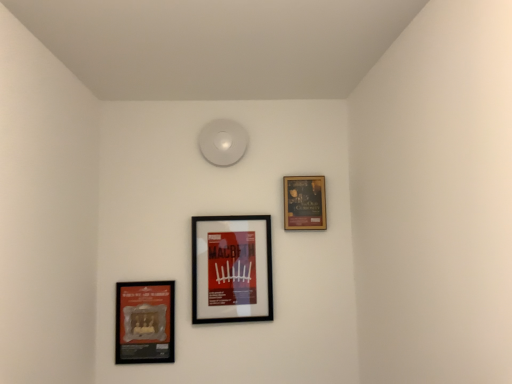
Question: Is the depth of wooden frame at upper right, acting as the first picture frame starting from the right, less than that of matte black picture frame at lower left, positioned as the 3th picture frame in right-to-left order?

Choices:
 (A) yes
 (B) no

Answer: (B)

Question: Does wooden frame at upper right, marked as the third picture frame in a left-to-right arrangement, have a lesser height compared to matte black picture frame at lower left, positioned as the 3th picture frame in right-to-left order?

Choices:
 (A) yes
 (B) no

Answer: (A)

Question: Is wooden frame at upper right, acting as the first picture frame starting from the right, not close to matte black picture frame at lower left, the first picture frame when ordered from left to right?

Choices:
 (A) yes
 (B) no

Answer: (B)

Question: From a real-world perspective, is wooden frame at upper right, acting as the first picture frame starting from the right, below matte black picture frame at lower left, positioned as the 3th picture frame in right-to-left order?

Choices:
 (A) yes
 (B) no

Answer: (B)

Question: Is wooden frame at upper right, acting as the first picture frame starting from the right, next to matte black picture frame at lower left, the first picture frame when ordered from left to right?

Choices:
 (A) yes
 (B) no

Answer: (B)

Question: Is wooden frame at upper right, acting as the first picture frame starting from the right, further to camera compared to matte black picture frame at lower left, positioned as the 3th picture frame in right-to-left order?

Choices:
 (A) yes
 (B) no

Answer: (A)

Question: Can you confirm if wooden frame at upper right, acting as the first picture frame starting from the right, is bigger than black matte picture frame at center, the second picture frame from the right?

Choices:
 (A) yes
 (B) no

Answer: (B)

Question: Is wooden frame at upper right, acting as the first picture frame starting from the right, to the left of black matte picture frame at center, the second picture frame from the right, from the viewer's perspective?

Choices:
 (A) yes
 (B) no

Answer: (B)

Question: Does wooden frame at upper right, marked as the third picture frame in a left-to-right arrangement, turn towards black matte picture frame at center, the 2th picture frame from the left?

Choices:
 (A) yes
 (B) no

Answer: (B)

Question: Can you confirm if wooden frame at upper right, acting as the first picture frame starting from the right, is wider than black matte picture frame at center, the 2th picture frame from the left?

Choices:
 (A) no
 (B) yes

Answer: (A)

Question: From the image's perspective, would you say wooden frame at upper right, acting as the first picture frame starting from the right, is shown under black matte picture frame at center, the second picture frame from the right?

Choices:
 (A) no
 (B) yes

Answer: (A)

Question: From the image's perspective, does wooden frame at upper right, marked as the third picture frame in a left-to-right arrangement, appear higher than black matte picture frame at center, the 2th picture frame from the left?

Choices:
 (A) yes
 (B) no

Answer: (A)

Question: Does black matte picture frame at center, the 2th picture frame from the left, contain wooden frame at upper right, marked as the third picture frame in a left-to-right arrangement?

Choices:
 (A) no
 (B) yes

Answer: (A)